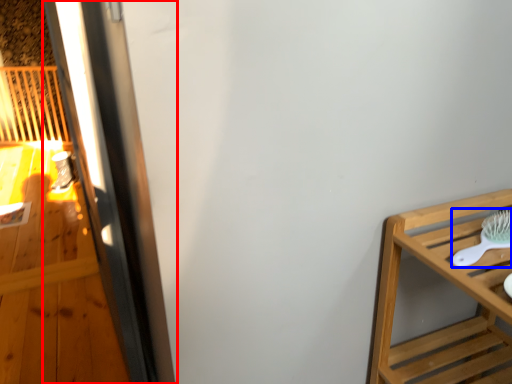
Question: Which object appears farthest to the camera in this image, screen door (highlighted by a red box) or brush (highlighted by a blue box)?

Choices:
 (A) screen door
 (B) brush

Answer: (A)